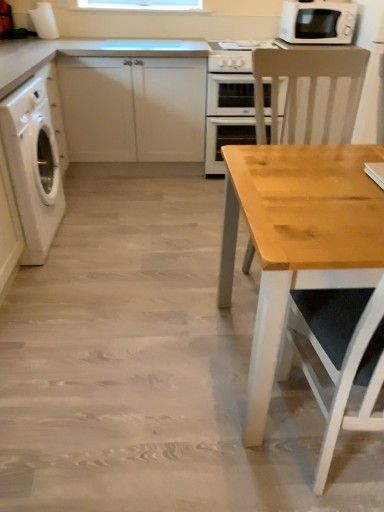
Question: From a real-world perspective, relative to white glossy oven at center, is beige plastic microwave at upper right vertically above or below?

Choices:
 (A) above
 (B) below

Answer: (A)

Question: In the image, is beige plastic microwave at upper right positioned in front of or behind white glossy oven at center?

Choices:
 (A) behind
 (B) front

Answer: (B)

Question: Which object is the closest to the white glossy oven at center?

Choices:
 (A) white glossy washing machine at left
 (B) beige plastic microwave at upper right
 (C) natural wood table at right
 (D) white glossy gas stove at upper center
 (E) light wood chair at right

Answer: (D)

Question: Estimate the real-world distances between objects in this image. Which object is closer to the white glossy washing machine at left?

Choices:
 (A) white glossy oven at center
 (B) beige plastic microwave at upper right
 (C) light wood chair at right
 (D) white matte cabinet at left
 (E) white glossy gas stove at upper center

Answer: (D)